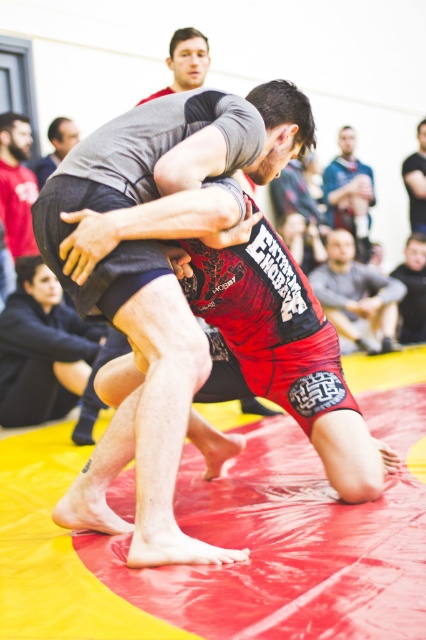
Between blue fabric shirt at upper center and matte gray shirt at upper left, which one has more height?

blue fabric shirt at upper center is taller.

Who is more forward, (365, 236) or (45, 179)?

Positioned in front is point (45, 179).

I want to click on blue fabric shirt at upper center, so click(350, 193).

Can you confirm if dark gray fabric shirt at lower left is thinner than matte gray shirt at upper left?

No, dark gray fabric shirt at lower left is not thinner than matte gray shirt at upper left.

Measure the distance between dark gray fabric shirt at lower left and camera.

dark gray fabric shirt at lower left is 14.26 feet away from camera.

The image size is (426, 640). I want to click on dark gray fabric shirt at lower left, so (42, 349).

Between red fabric shorts at center and matte gray shirt at upper left, which one is positioned lower?

red fabric shorts at center is below.

Which is more to the left, red fabric shorts at center or matte gray shirt at upper left?

Positioned to the left is matte gray shirt at upper left.

Identify the location of red fabric shorts at center. (157, 285).